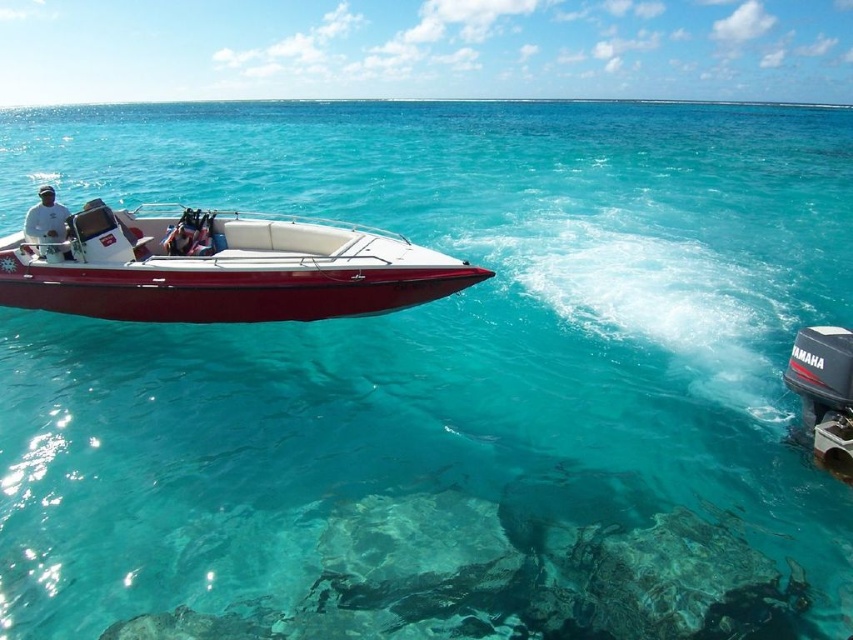
Can you confirm if black rubber outboard motor at lower right is positioned below white matte shirt at left?

Yes.

Does black rubber outboard motor at lower right appear on the left side of white matte shirt at left?

Incorrect, black rubber outboard motor at lower right is not on the left side of white matte shirt at left.

Between point (822, 333) and point (51, 225), which one is positioned in front?

Positioned in front is point (822, 333).

Locate an element on the screen. The image size is (853, 640). black rubber outboard motor at lower right is located at coordinates click(x=824, y=394).

Can you confirm if glossy fiberglass speedboat at left is shorter than white matte shirt at left?

Correct, glossy fiberglass speedboat at left is not as tall as white matte shirt at left.

Is point (317, 291) positioned after point (44, 216)?

That is False.

This screenshot has height=640, width=853. I want to click on glossy fiberglass speedboat at left, so click(x=219, y=268).

Who is more distant from viewer, (73, 260) or (810, 429)?

Point (73, 260)

Can you confirm if glossy fiberglass speedboat at left is positioned below black rubber outboard motor at lower right?

No, glossy fiberglass speedboat at left is not below black rubber outboard motor at lower right.

Does point (387, 280) come behind point (798, 336)?

Yes, it is.

This screenshot has height=640, width=853. In order to click on glossy fiberglass speedboat at left in this screenshot , I will do `click(219, 268)`.